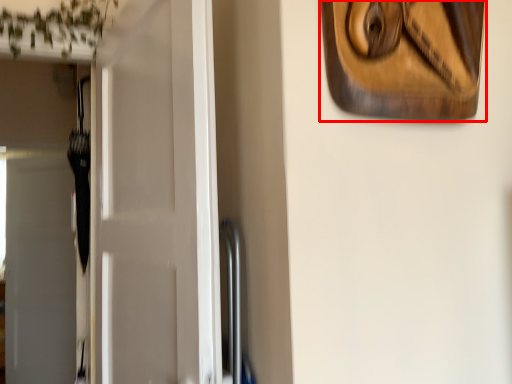
Question: From the image's perspective, where is picture frame (annotated by the red box) located in relation to door in the image?

Choices:
 (A) above
 (B) below

Answer: (A)